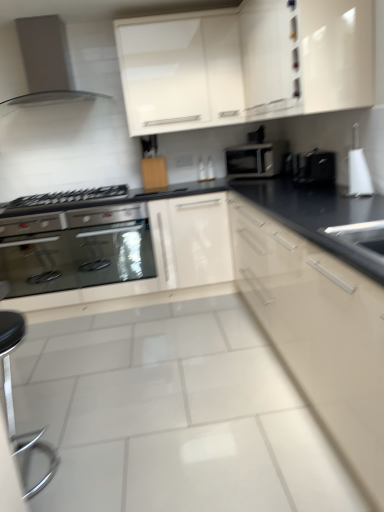
Question: Should I look upward or downward to see black plastic knife block at center, which is the 1th appliance in back-to-front order?

Choices:
 (A) down
 (B) up

Answer: (B)

Question: Which direction should I rotate to face white glossy cabinet at upper center, which is counted as the second cabinetry, starting from the left, — up or down?

Choices:
 (A) up
 (B) down

Answer: (A)

Question: Is stainless steel oven at lower left surrounded by white glossy cabinet at upper center, acting as the first cabinetry starting from the right?

Choices:
 (A) no
 (B) yes

Answer: (A)

Question: Considering the relative sizes of white glossy cabinet at upper center, which is the 3th cabinetry in left-to-right order, and stainless steel oven at lower left in the image provided, is white glossy cabinet at upper center, which is the 3th cabinetry in left-to-right order, shorter than stainless steel oven at lower left?

Choices:
 (A) yes
 (B) no

Answer: (B)

Question: From the image's perspective, is white glossy cabinet at upper center, which is the 3th cabinetry in left-to-right order, on top of stainless steel oven at lower left?

Choices:
 (A) yes
 (B) no

Answer: (A)

Question: Does white glossy cabinet at upper center, acting as the first cabinetry starting from the right, appear on the right side of stainless steel oven at lower left?

Choices:
 (A) no
 (B) yes

Answer: (B)

Question: From a real-world perspective, is white glossy cabinet at upper center, which is the 3th cabinetry in left-to-right order, physically above stainless steel oven at lower left?

Choices:
 (A) no
 (B) yes

Answer: (B)

Question: From a real-world perspective, does white glossy cabinet at upper center, which is counted as the second cabinetry, starting from the left, sit lower than polished chrome bar stool at lower left?

Choices:
 (A) yes
 (B) no

Answer: (B)

Question: Is white glossy cabinet at upper center, the 2th cabinetry viewed from the right, at the left side of polished chrome bar stool at lower left?

Choices:
 (A) no
 (B) yes

Answer: (A)

Question: From the image's perspective, is white glossy cabinet at upper center, which is counted as the second cabinetry, starting from the left, located above polished chrome bar stool at lower left?

Choices:
 (A) yes
 (B) no

Answer: (A)

Question: Can you confirm if white glossy cabinet at upper center, the 2th cabinetry viewed from the right, is bigger than polished chrome bar stool at lower left?

Choices:
 (A) no
 (B) yes

Answer: (B)

Question: Considering the relative sizes of white glossy cabinet at upper center, which is counted as the second cabinetry, starting from the left, and polished chrome bar stool at lower left in the image provided, is white glossy cabinet at upper center, which is counted as the second cabinetry, starting from the left, wider than polished chrome bar stool at lower left?

Choices:
 (A) no
 (B) yes

Answer: (A)

Question: Could you tell me if white glossy cabinet at upper center, which is counted as the second cabinetry, starting from the left, is facing polished chrome bar stool at lower left?

Choices:
 (A) yes
 (B) no

Answer: (B)

Question: Does wooden cutting board at center, the first cabinetry viewed from the left, touch stainless steel oven at lower left?

Choices:
 (A) no
 (B) yes

Answer: (A)